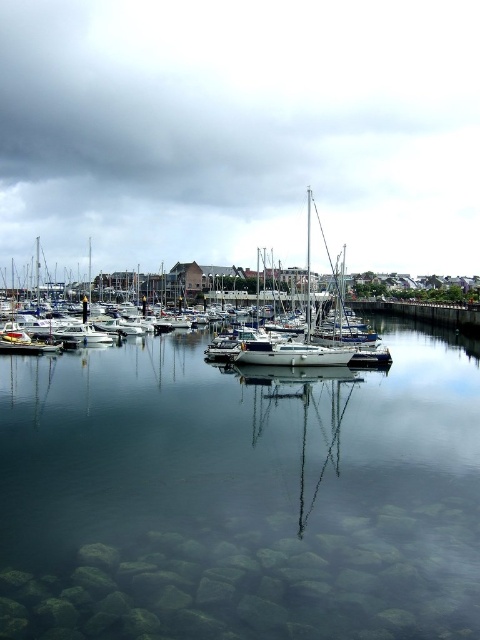
You are standing on the stone wall overlooking the marina and see the matte white boats at center and the white glossy sailboat at center. Which boat is closer to you?

The matte white boats at center are closer to you because they are positioned further to the viewer than the white glossy sailboat at center.